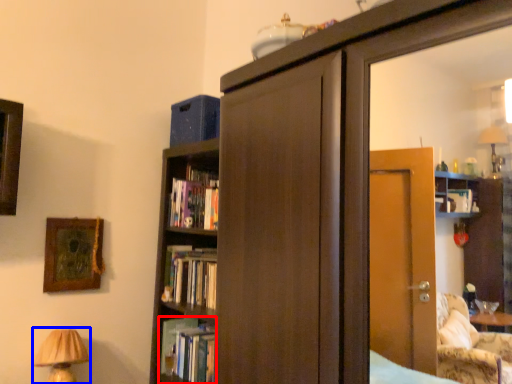
Question: Which object appears farthest to the camera in this image, book (highlighted by a red box) or table lamp (highlighted by a blue box)?

Choices:
 (A) book
 (B) table lamp

Answer: (A)